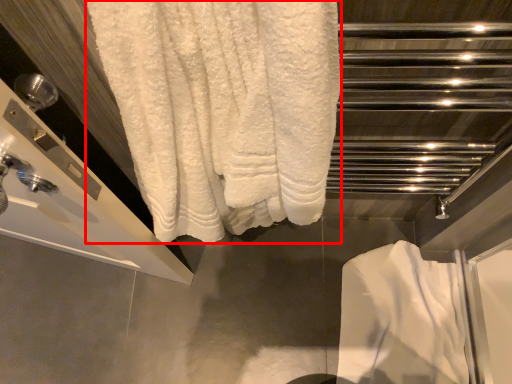
Question: From the image's perspective, considering the relative positions of towel (annotated by the red box) and bath towel in the image provided, where is towel (annotated by the red box) located with respect to the staircase?

Choices:
 (A) above
 (B) below

Answer: (A)